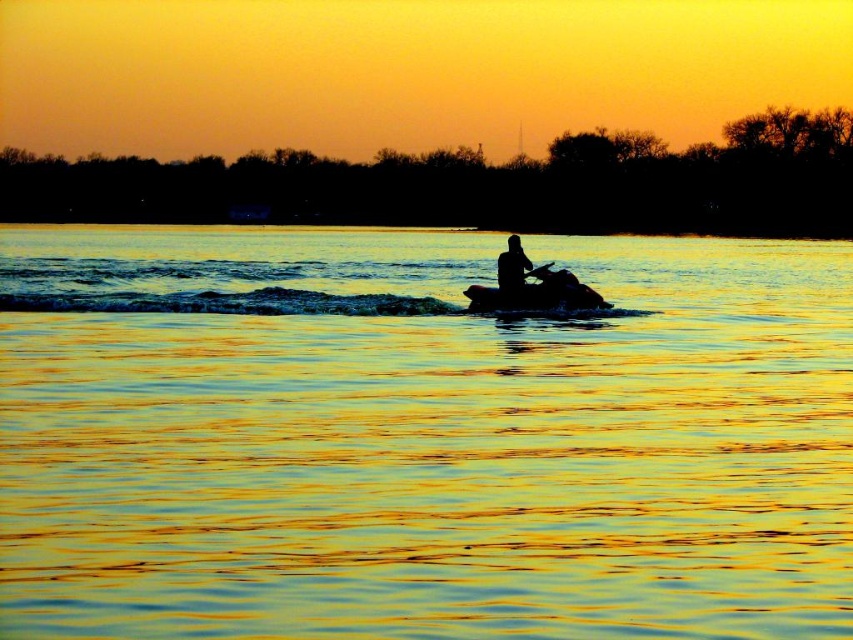
Question: Can you confirm if golden reflective water at center is wider than black rubber paddle at center?

Choices:
 (A) yes
 (B) no

Answer: (A)

Question: Is black plastic paddle at center below black rubber paddle at center?

Choices:
 (A) yes
 (B) no

Answer: (A)

Question: Which point is farther from the camera taking this photo?

Choices:
 (A) (527, 310)
 (B) (548, 266)

Answer: (A)

Question: Which of the following is the farthest from the observer?

Choices:
 (A) (532, 273)
 (B) (450, 582)
 (C) (589, 301)
 (D) (534, 273)

Answer: (C)

Question: Among these points, which one is farthest from the camera?

Choices:
 (A) (519, 291)
 (B) (248, 390)

Answer: (A)

Question: Does golden reflective water at center have a larger size compared to black matte jet ski at center?

Choices:
 (A) no
 (B) yes

Answer: (B)